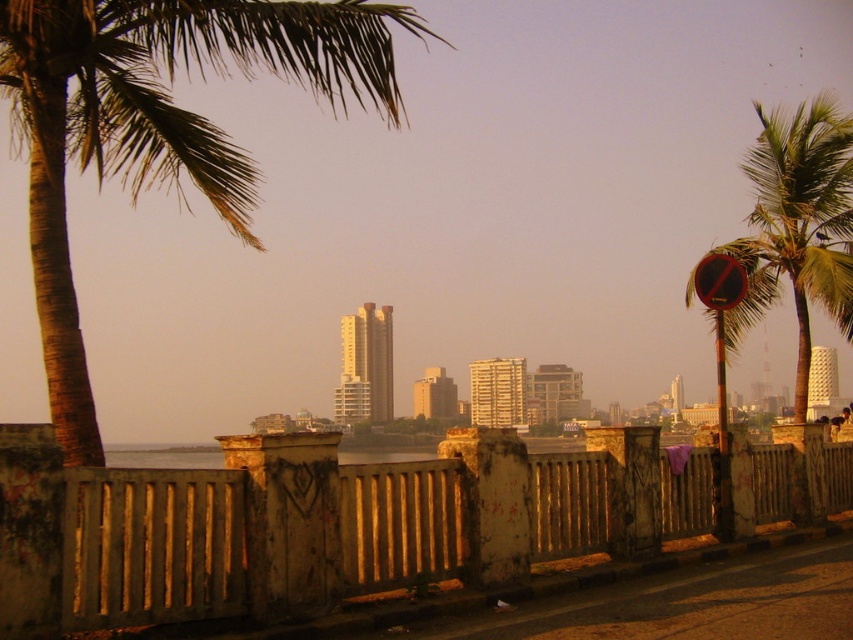
At what (x,y) coordinates should I click in order to perform the action: click on rusty metal fence at center. Please return your answer as a coordinate pair (x, y). Looking at the image, I should click on coord(317,524).

Is brown textured palm tree at upper left to the right of green leafy palm tree at right from the viewer's perspective?

Incorrect, brown textured palm tree at upper left is not on the right side of green leafy palm tree at right.

Which is behind, point (376, 70) or point (843, 134)?

Point (843, 134)

Who is more distant from viewer, (96, 60) or (845, 285)?

The point (845, 285) is more distant.

Locate an element on the screen. This screenshot has height=640, width=853. brown textured palm tree at upper left is located at coordinates pyautogui.click(x=160, y=124).

Who is positioned more to the left, rusty metal fence at center or brown textured palm tree at upper left?

Positioned to the left is brown textured palm tree at upper left.

The width and height of the screenshot is (853, 640). What do you see at coordinates (317, 524) in the screenshot?
I see `rusty metal fence at center` at bounding box center [317, 524].

The height and width of the screenshot is (640, 853). What do you see at coordinates (317, 524) in the screenshot? I see `rusty metal fence at center` at bounding box center [317, 524].

Image resolution: width=853 pixels, height=640 pixels. What are the coordinates of `rusty metal fence at center` in the screenshot? It's located at (317, 524).